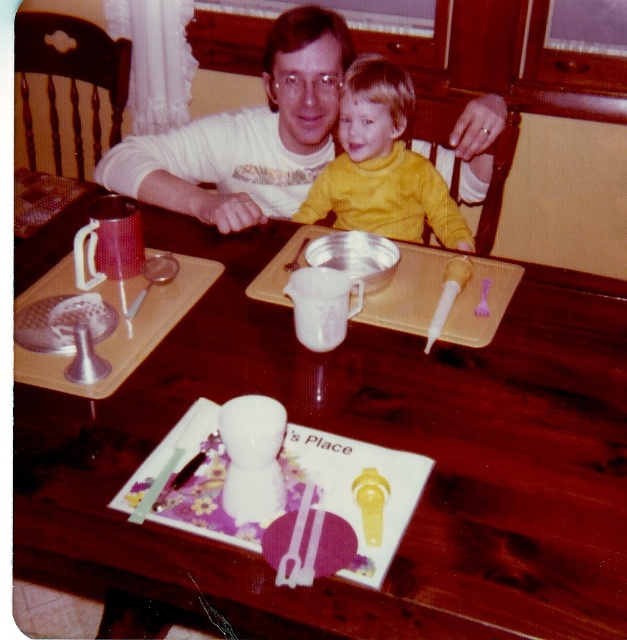
Question: Which object appears farthest from the camera in this image?

Choices:
 (A) wooden table at center
 (B) white matte shirt at upper center

Answer: (B)

Question: Can you confirm if white matte shirt at upper center is positioned below yellow matte shirt at center?

Choices:
 (A) yes
 (B) no

Answer: (B)

Question: Which of these objects is positioned farthest from the white matte shirt at upper center?

Choices:
 (A) wooden table at center
 (B) yellow matte shirt at center

Answer: (A)

Question: Among these objects, which one is nearest to the camera?

Choices:
 (A) white matte shirt at upper center
 (B) yellow matte shirt at center
 (C) wooden table at center

Answer: (C)

Question: Can you confirm if wooden table at center is positioned to the right of white matte shirt at upper center?

Choices:
 (A) no
 (B) yes

Answer: (B)

Question: Is white matte shirt at upper center thinner than yellow matte shirt at center?

Choices:
 (A) yes
 (B) no

Answer: (B)